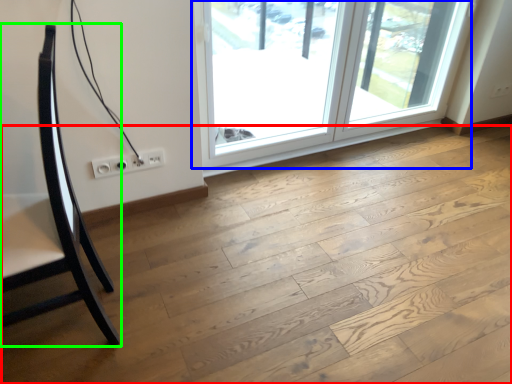
Question: Considering the real-world distances, which object is farthest from plywood (highlighted by a red box)? window (highlighted by a blue box) or furniture (highlighted by a green box)?

Choices:
 (A) window
 (B) furniture

Answer: (A)